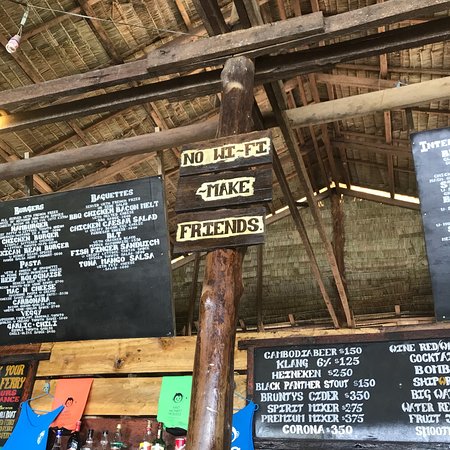
The height and width of the screenshot is (450, 450). What are the coordinates of `menu board` in the screenshot? It's located at click(x=444, y=200), click(x=366, y=371), click(x=66, y=260), click(x=10, y=390).